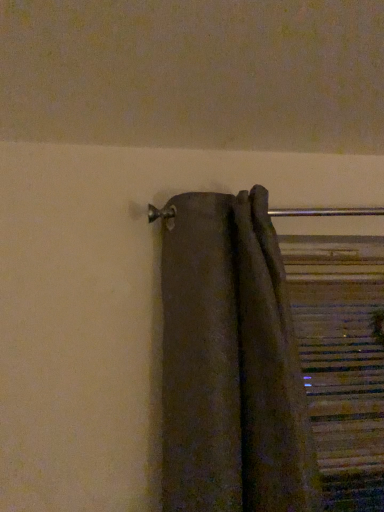
Describe the element at coordinates (230, 362) in the screenshot. I see `brown textured curtain at upper right` at that location.

Identify the location of brown textured curtain at upper right. This screenshot has width=384, height=512. (230, 362).

Image resolution: width=384 pixels, height=512 pixels. In order to click on brown textured curtain at upper right in this screenshot , I will do `click(230, 362)`.